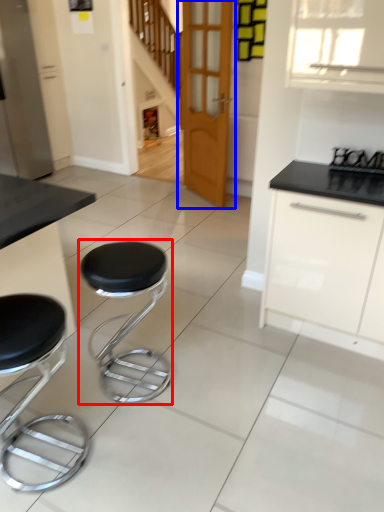
Question: Which of the following is the farthest to the observer, stool (highlighted by a red box) or door (highlighted by a blue box)?

Choices:
 (A) stool
 (B) door

Answer: (B)